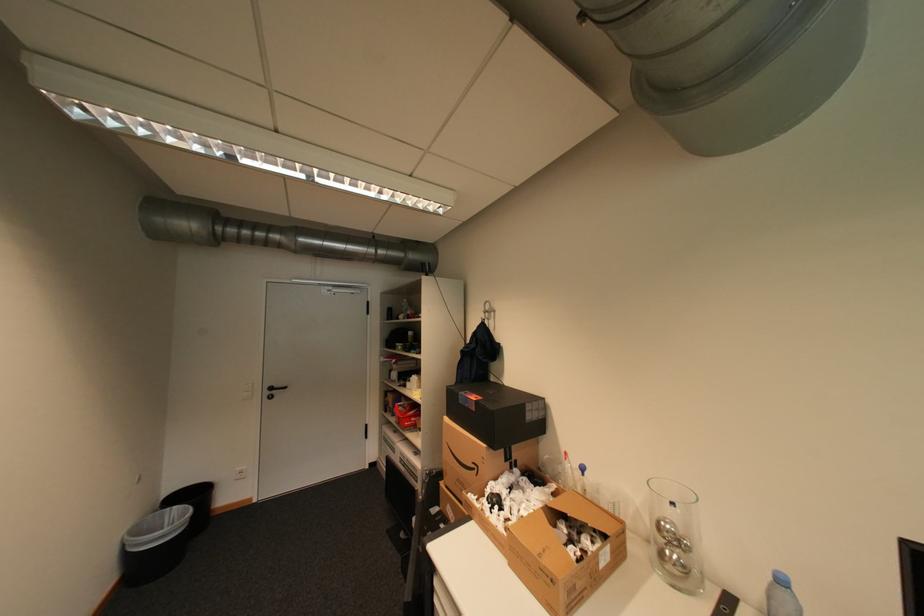
Find where to lift the clear glass vase. Please return your answer as a coordinate pair (x, y).

(675, 535)